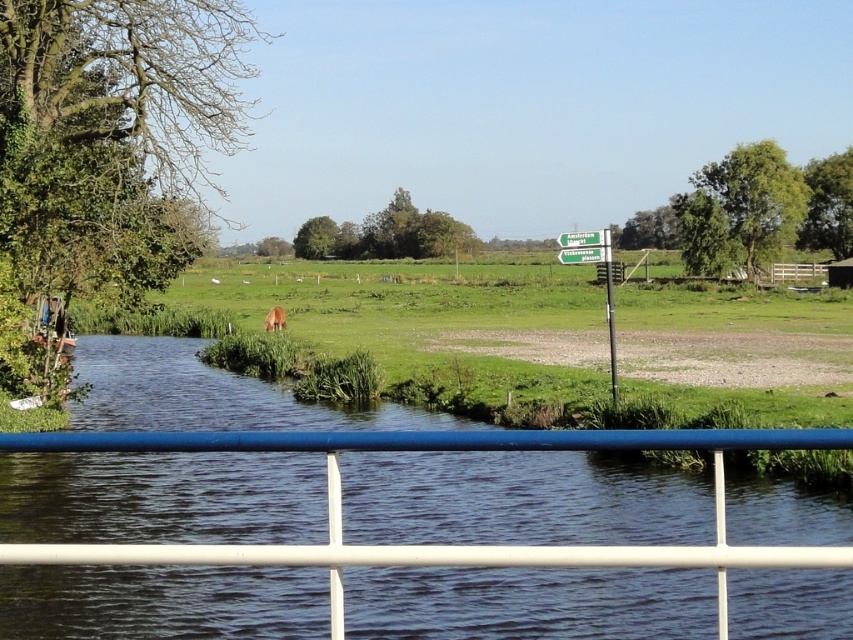
Is point (595, 230) closer to camera compared to point (589, 257)?

No.

Does green plastic signpost at center appear under green plastic sign at center?

Yes, green plastic signpost at center is below green plastic sign at center.

Describe the element at coordinates (604, 275) in the screenshot. The width and height of the screenshot is (853, 640). I see `green plastic signpost at center` at that location.

The height and width of the screenshot is (640, 853). What are the coordinates of `green plastic signpost at center` in the screenshot? It's located at (604, 275).

Is green plastic sign at center above brown furry dog at center?

Correct, green plastic sign at center is located above brown furry dog at center.

Which is above, green plastic sign at center or brown furry dog at center?

Positioned higher is green plastic sign at center.

Is point (585, 250) behind point (279, 321)?

That is False.

Locate an element on the screen. Image resolution: width=853 pixels, height=640 pixels. green plastic sign at center is located at coordinates pos(582,253).

In the scene shown: How far apart are green plastic signpost at center and brown furry dog at center?

green plastic signpost at center and brown furry dog at center are 16.46 meters apart from each other.

Can you confirm if green plastic signpost at center is positioned below brown furry dog at center?

No, green plastic signpost at center is not below brown furry dog at center.

Does point (611, 272) lie in front of point (267, 314)?

Yes, it is.

I want to click on green plastic signpost at center, so click(604, 275).